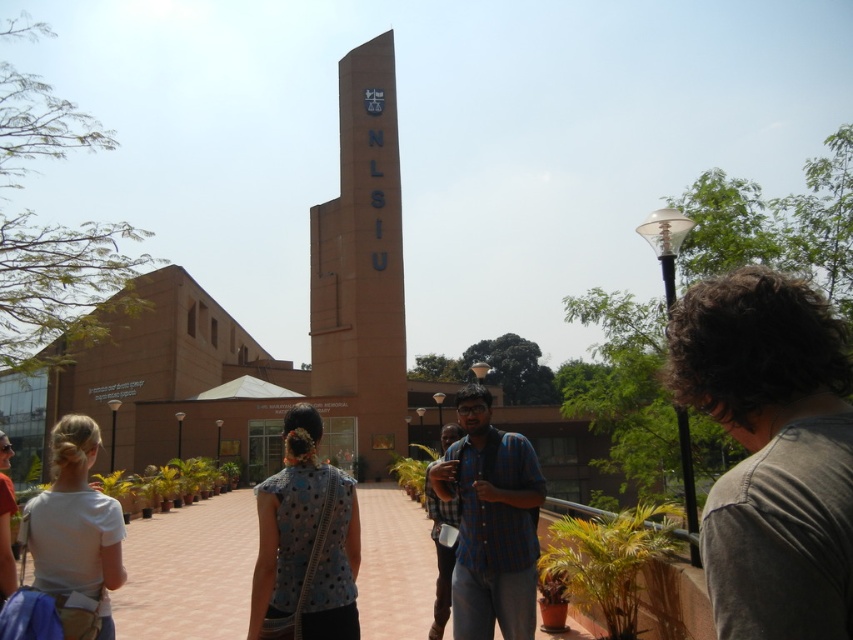
Question: Among these objects, which one is nearest to the camera?

Choices:
 (A) white matte shirt at lower left
 (B) checkered fabric shirt at center

Answer: (A)

Question: Among these objects, which one is farthest from the camera?

Choices:
 (A) brown matte tower at center
 (B) blue dotted blouse at center
 (C) brown brick pathway at center
 (D) white matte shirt at lower left

Answer: (A)

Question: Which point appears closest to the camera in this image?

Choices:
 (A) (366, 248)
 (B) (354, 512)
 (C) (474, 545)

Answer: (B)

Question: From the image, what is the correct spatial relationship of brown brick pathway at center in relation to checkered fabric shirt at center?

Choices:
 (A) above
 (B) below

Answer: (B)

Question: Can you confirm if brown matte tower at center is positioned above blue dotted blouse at center?

Choices:
 (A) yes
 (B) no

Answer: (A)

Question: Can you confirm if brown matte tower at center is smaller than white matte shirt at lower left?

Choices:
 (A) no
 (B) yes

Answer: (B)